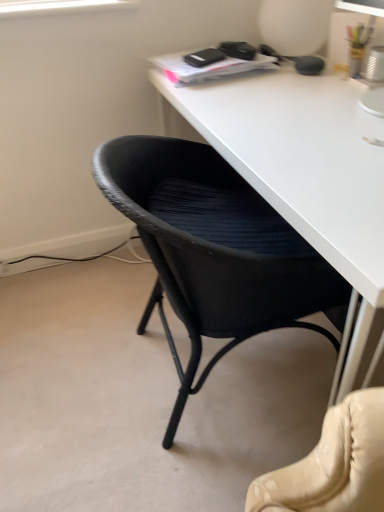
Find the location of a particular element. vacant region under black woven chair at center (from a real-world perspective) is located at coordinates (175, 379).